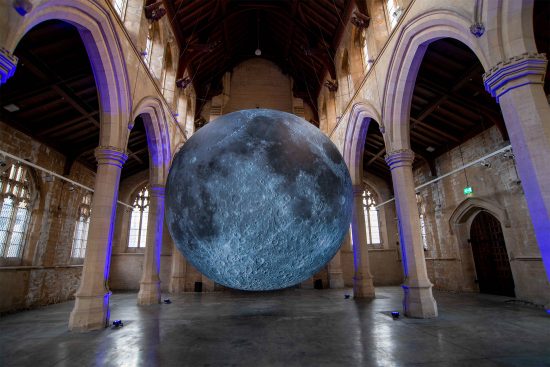
I want to click on marble, so click(192, 349).